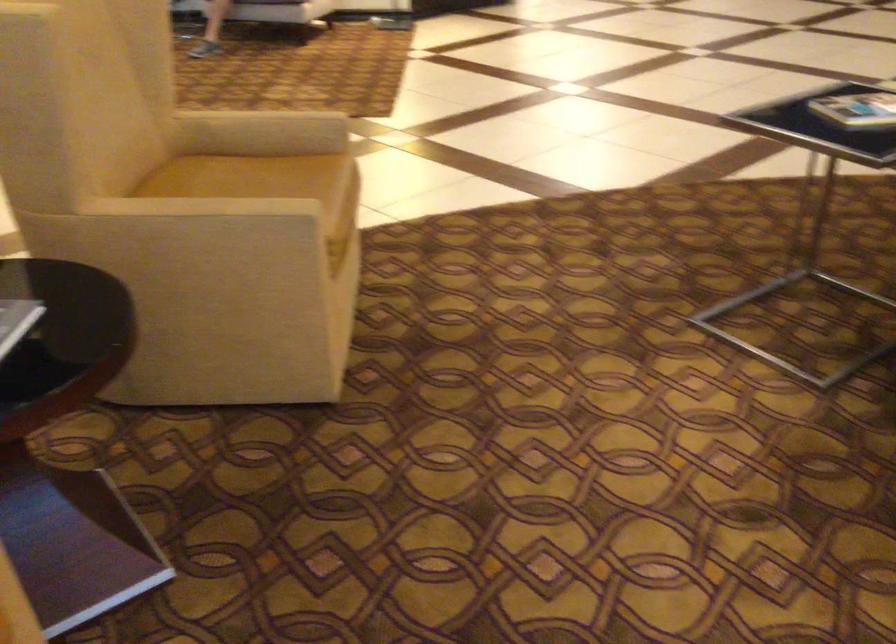
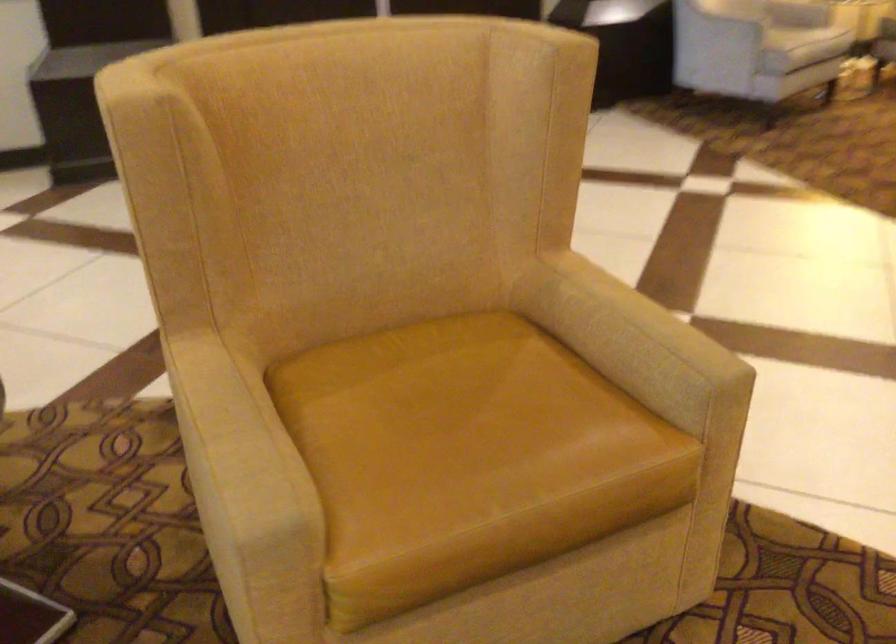
Where in the second image is the point corresponding to point (268, 191) from the first image?

(452, 426)